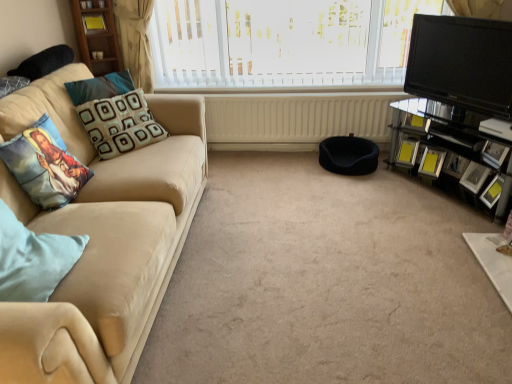
Question: Considering the relative positions of black fabric footrest at center and white textured blinds at upper center in the image provided, is black fabric footrest at center to the left or to the right of white textured blinds at upper center?

Choices:
 (A) right
 (B) left

Answer: (A)

Question: From a real-world perspective, is black fabric footrest at center above or below white textured blinds at upper center?

Choices:
 (A) above
 (B) below

Answer: (B)

Question: Which object is the farthest from the white textured blinds at upper center?

Choices:
 (A) beige fabric couch at left
 (B) black glossy tv at upper right
 (C) light blue fabric pillow at left, the third pillow from the back
 (D) matte black picture frame at right, which is the 3th picture frame from back to front
 (E) yellow glossy picture frame at right, the fourth picture frame from the back

Answer: (C)

Question: Based on their relative distances, which object is nearer to the white textured blinds at upper center?

Choices:
 (A) yellow glossy picture frame at right, the fourth picture frame from the back
 (B) carpet at center
 (C) cream matte radiator at center
 (D) printed fabric pillow at left, acting as the second pillow starting from the back
 (E) metallic silver picture frame at right, the 2th picture frame viewed from the back

Answer: (C)